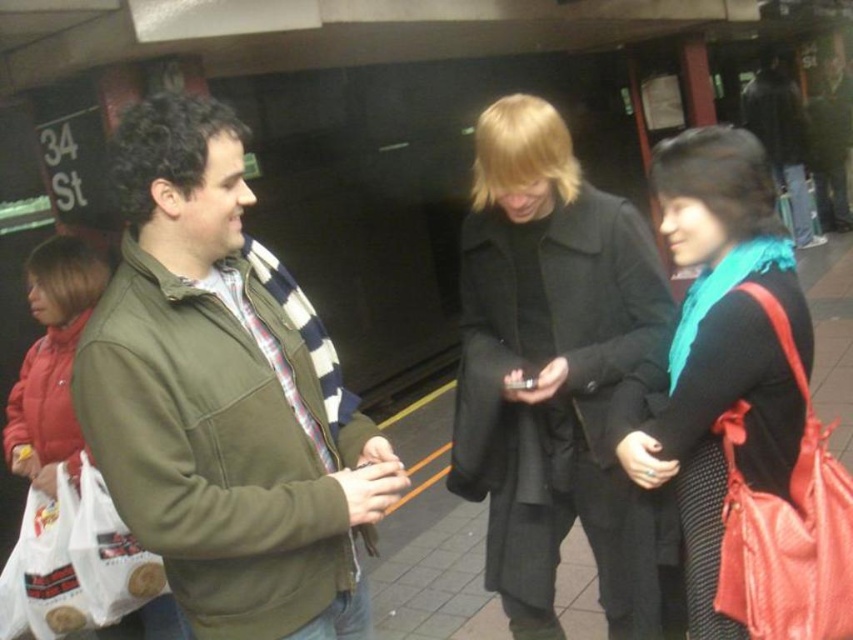
Question: Does matte green jacket at left appear under teal fabric scarf at center?

Choices:
 (A) yes
 (B) no

Answer: (B)

Question: Is black wool coat at center further to the viewer compared to teal fabric scarf at center?

Choices:
 (A) no
 (B) yes

Answer: (B)

Question: Which object is positioned closest to the teal fabric scarf at center?

Choices:
 (A) black wool coat at center
 (B) matte green jacket at left

Answer: (A)

Question: Which point appears closest to the camera in this image?

Choices:
 (A) (370, 524)
 (B) (705, 260)
 (C) (534, 509)

Answer: (A)

Question: Which point appears farthest from the camera in this image?

Choices:
 (A) (508, 218)
 (B) (206, 172)

Answer: (A)

Question: Does black wool coat at center have a larger size compared to teal fabric scarf at center?

Choices:
 (A) yes
 (B) no

Answer: (A)